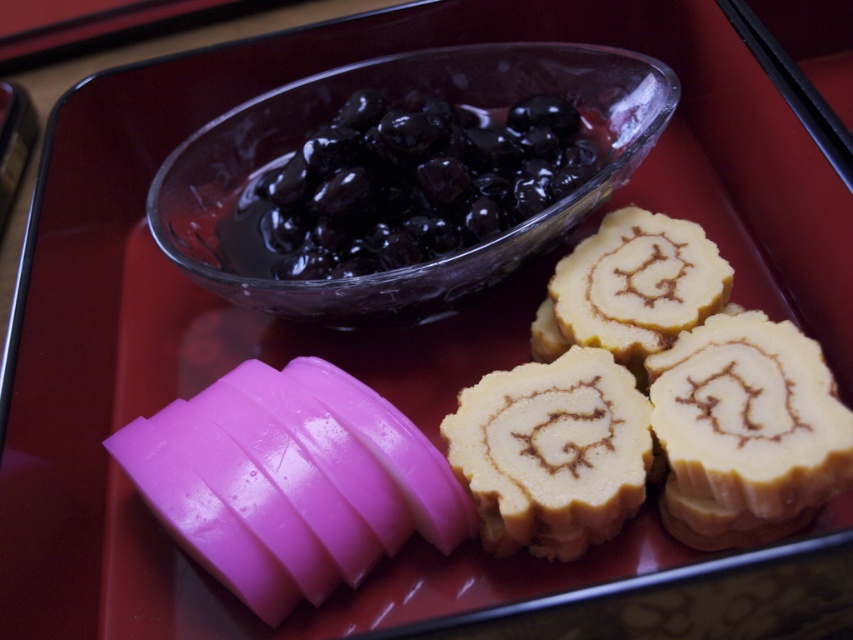
Looking at this image, you are standing 50 centimeters away from the yellow sponge cake at right. Can you reach it without moving your position?

The yellow sponge cake at right is 52.34 centimeters away from the viewer, so you are 2.34 centimeters too far to reach it without moving.

You are a food delivery person who needs to place the yellow sponge cake at right and the glossy dark blue grapes at upper center into a smaller container. Which one should you place first to ensure they both fit?

The yellow sponge cake at right should be placed first since it is below the glossy dark blue grapes at upper center, meaning it is closer to the bottom of the container, allowing the grapes to be placed on top without overcrowding.

You are a food delivery robot that needs to pick up the clear glass bowl from the tray. The robot has a camera that can detect specific points on the tray. There is a point at coordinates (x=415, y=182). What object is located at this point?

The point at coordinates (x=415, y=182) is on the glossy dark blue grapes at upper center.